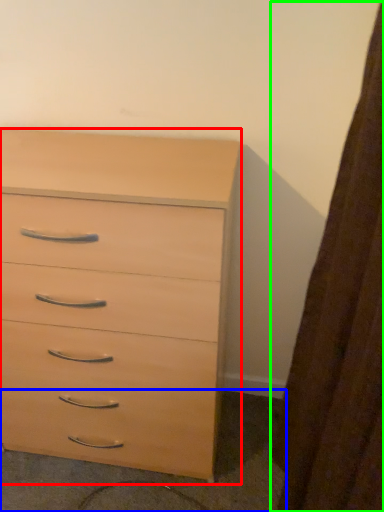
Question: Estimate the real-world distances between objects in this image. Which object is farther from chest of drawers (highlighted by a red box), concrete (highlighted by a blue box) or curtain (highlighted by a green box)?

Choices:
 (A) concrete
 (B) curtain

Answer: (B)